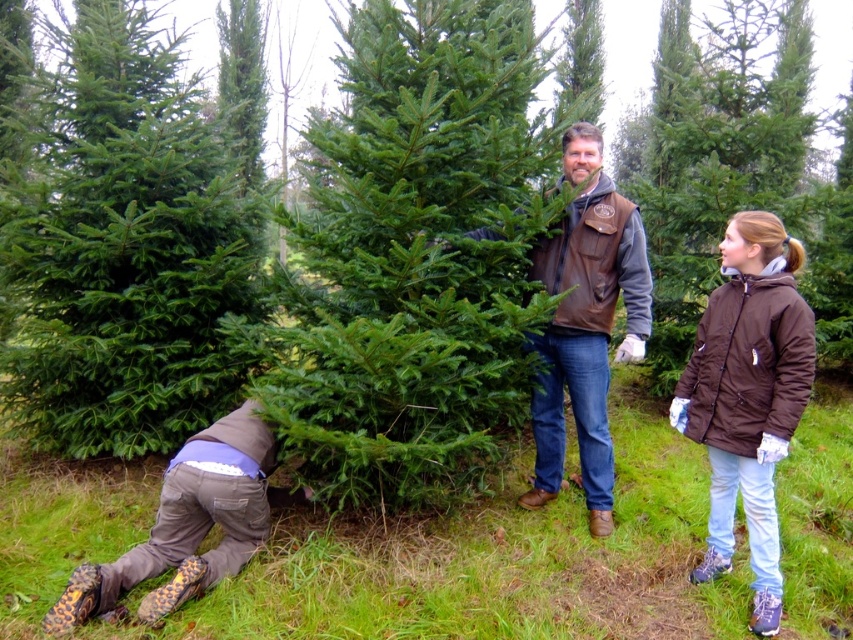
Question: Which point appears closest to the camera in this image?

Choices:
 (A) (454, 150)
 (B) (161, 484)
 (C) (165, 253)

Answer: (B)

Question: Is brown puffy jacket at right positioned before brown leather vest at center?

Choices:
 (A) no
 (B) yes

Answer: (B)

Question: Which of the following is the farthest from the observer?

Choices:
 (A) green matte tree at center
 (B) green matte christmas tree at center
 (C) green matte fir tree at lower left

Answer: (A)

Question: Is green matte fir tree at lower left smaller than green matte tree at center?

Choices:
 (A) no
 (B) yes

Answer: (A)

Question: Is green matte fir tree at lower left closer to the viewer compared to green matte tree at center?

Choices:
 (A) no
 (B) yes

Answer: (B)

Question: Which point is closer to the camera taking this photo?

Choices:
 (A) (131, 285)
 (B) (759, 460)

Answer: (B)